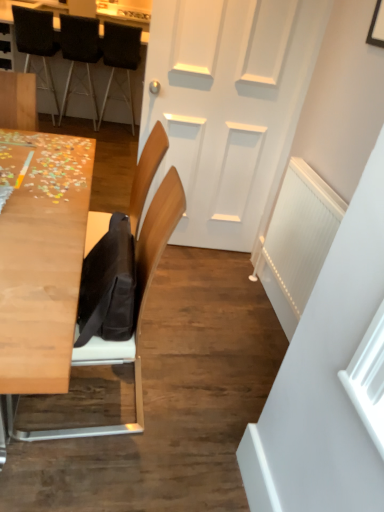
Question: From the image's perspective, would you say wooden puzzle pieces at upper left, the first table viewed from the top, is shown under dark brown leather chair at upper left, which is counted as the 3th chair, starting from the back?

Choices:
 (A) yes
 (B) no

Answer: (B)

Question: From a real-world perspective, is wooden puzzle pieces at upper left, marked as the 2th table in a front-to-back arrangement, physically below dark brown leather chair at upper left, the 2th chair from the front?

Choices:
 (A) no
 (B) yes

Answer: (B)

Question: Considering the relative sizes of wooden puzzle pieces at upper left, which ranks as the second table in bottom-to-top order, and dark brown leather chair at upper left, the 2th chair from the front, in the image provided, is wooden puzzle pieces at upper left, which ranks as the second table in bottom-to-top order, thinner than dark brown leather chair at upper left, the 2th chair from the front,?

Choices:
 (A) no
 (B) yes

Answer: (A)

Question: From the image's perspective, does wooden puzzle pieces at upper left, marked as the 2th table in a front-to-back arrangement, appear higher than dark brown leather chair at upper left, which is counted as the 3th chair, starting from the back?

Choices:
 (A) no
 (B) yes

Answer: (B)

Question: Can you confirm if wooden puzzle pieces at upper left, marked as the 2th table in a front-to-back arrangement, is positioned to the left of dark brown leather chair at upper left, which is counted as the 3th chair, starting from the back?

Choices:
 (A) yes
 (B) no

Answer: (B)

Question: Is wooden puzzle pieces at upper left, which ranks as the second table in bottom-to-top order, outside dark brown leather chair at upper left, the 2th chair from the front?

Choices:
 (A) yes
 (B) no

Answer: (A)

Question: Is light wood table at left, the 2th table viewed from the top, with dark brown leather chair at upper left, which is counted as the 3th chair, starting from the back?

Choices:
 (A) yes
 (B) no

Answer: (B)

Question: Considering the relative sizes of light wood table at left, the 1th table when ordered from front to back, and dark brown leather chair at upper left, the 2th chair from the front, in the image provided, is light wood table at left, the 1th table when ordered from front to back, taller than dark brown leather chair at upper left, the 2th chair from the front,?

Choices:
 (A) no
 (B) yes

Answer: (A)

Question: Can you confirm if light wood table at left, which appears as the 2th table when viewed from the back, is shorter than dark brown leather chair at upper left, which is counted as the 3th chair, starting from the back?

Choices:
 (A) yes
 (B) no

Answer: (A)

Question: Does light wood table at left, the 2th table viewed from the top, have a lesser width compared to dark brown leather chair at upper left, which is counted as the 3th chair, starting from the back?

Choices:
 (A) no
 (B) yes

Answer: (A)

Question: From a real-world perspective, is light wood table at left, the first table when ordered from bottom to top, on dark brown leather chair at upper left, which is counted as the 3th chair, starting from the back?

Choices:
 (A) no
 (B) yes

Answer: (A)

Question: Is light wood table at left, the 2th table viewed from the top, oriented away from dark brown leather chair at upper left, which is counted as the 3th chair, starting from the back?

Choices:
 (A) no
 (B) yes

Answer: (A)

Question: Can you confirm if dark brown leather chair at upper left, the 2th chair from the front, is thinner than wooden puzzle pieces at upper left, the first table viewed from the top?

Choices:
 (A) yes
 (B) no

Answer: (A)